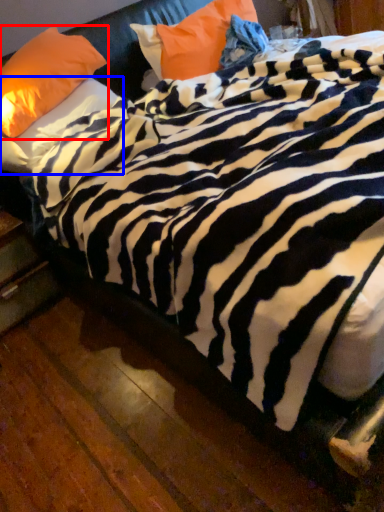
Question: Which object appears closest to the camera in this image, pillow (highlighted by a red box) or pillow (highlighted by a blue box)?

Choices:
 (A) pillow
 (B) pillow

Answer: (A)